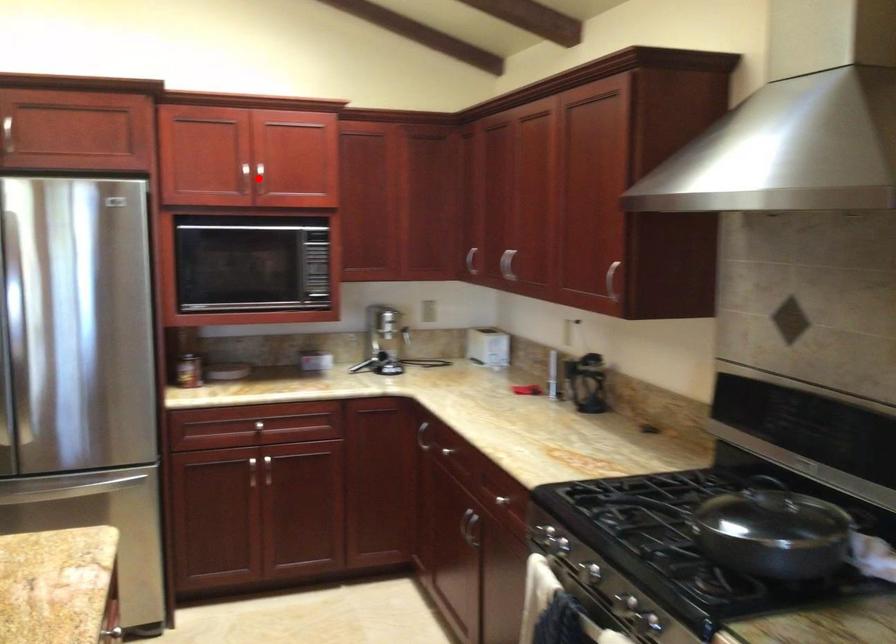
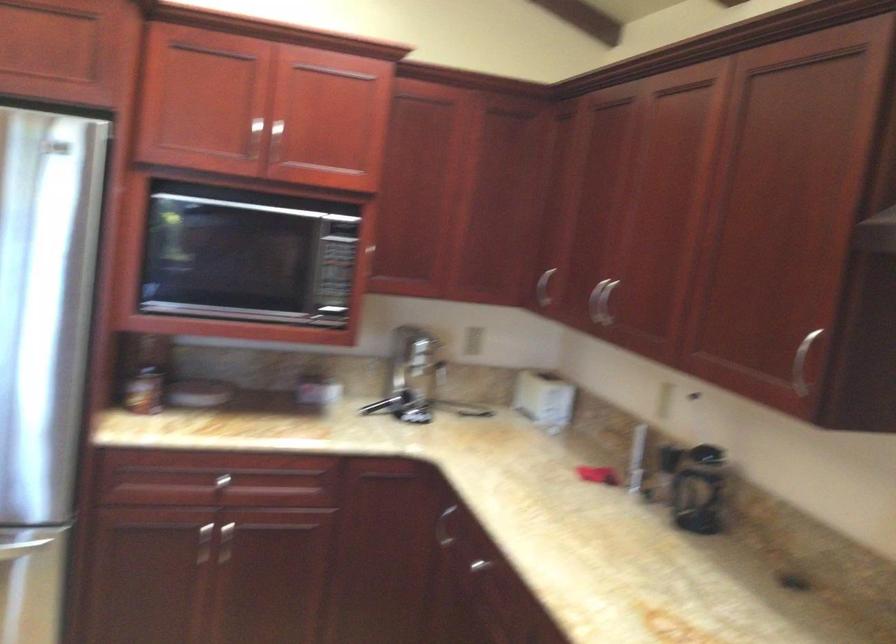
Locate, in the second image, the point that corresponds to the highlighted location in the first image.

(274, 140)